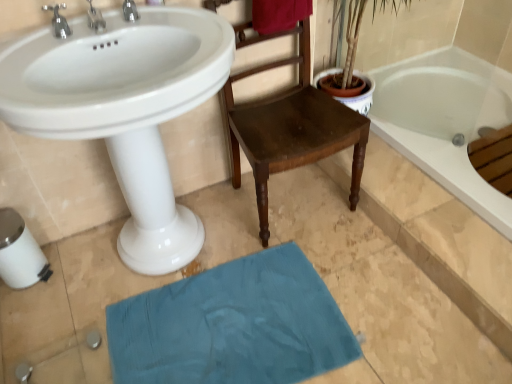
Locate an element on the screen. This screenshot has width=512, height=384. vacant space to the right of silver metallic faucet at upper left, placed as the 1th tap when sorted from left to right is located at coordinates (104, 31).